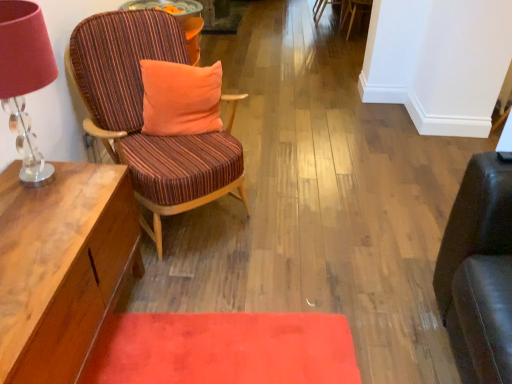
Locate an element on the screen. This screenshot has width=512, height=384. unoccupied region to the right of velvety red mat at lower center is located at coordinates (371, 304).